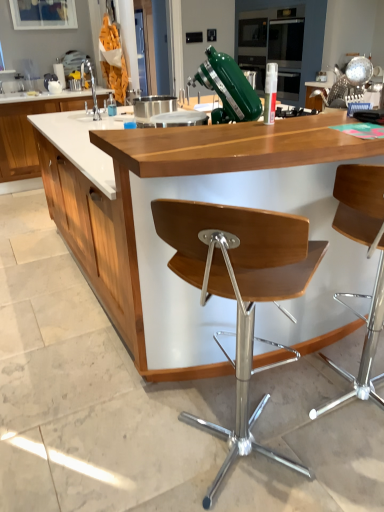
Question: From the image's perspective, is white wood cabinet at left above or below white marble countertop at upper left, which appears as the second countertop when ordered from the bottom?

Choices:
 (A) above
 (B) below

Answer: (B)

Question: Is white wood cabinet at left situated inside white marble countertop at upper left, positioned as the 1th countertop in left-to-right order, or outside?

Choices:
 (A) inside
 (B) outside

Answer: (B)

Question: Considering the real-world distances, which object is closest to the white marble countertop at upper left, the first countertop positioned from the back?

Choices:
 (A) wooden seat at center, acting as the 2th chair starting from the left
 (B) wooden chair at center, the 1th chair in the left-to-right sequence
 (C) wooden counter at center, which is the 1th countertop in right-to-left order
 (D) brushed metal sink at left
 (E) white wood cabinet at left

Answer: (E)

Question: Which is nearer to the wooden seat at center, the 1th chair viewed from the right?

Choices:
 (A) brushed metal sink at left
 (B) white wood cabinet at left
 (C) white marble countertop at upper left, marked as the 2th countertop in a front-to-back arrangement
 (D) wooden chair at center, which is the second chair from right to left
 (E) wooden counter at center, which is the 2th countertop from left to right

Answer: (E)